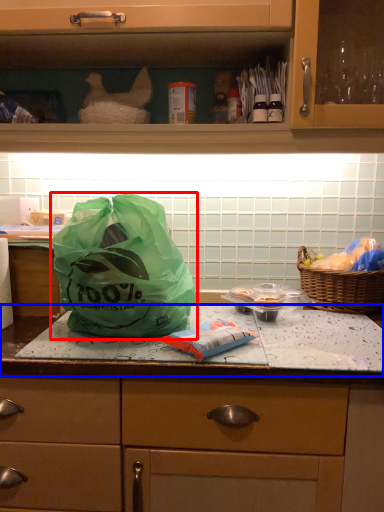
Question: Which point is further to the camera, plastic bag (highlighted by a red box) or counter top (highlighted by a blue box)?

Choices:
 (A) plastic bag
 (B) counter top

Answer: (B)